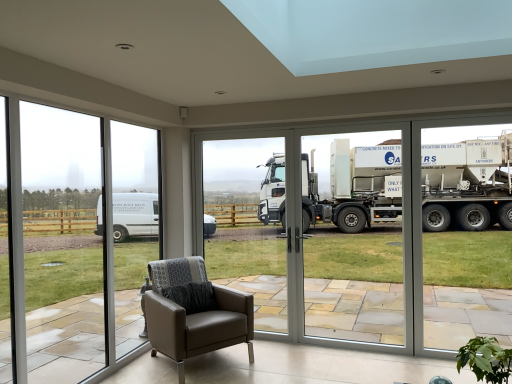
I want to click on free space above transparent glass door at center (from a real-world perspective), so click(234, 130).